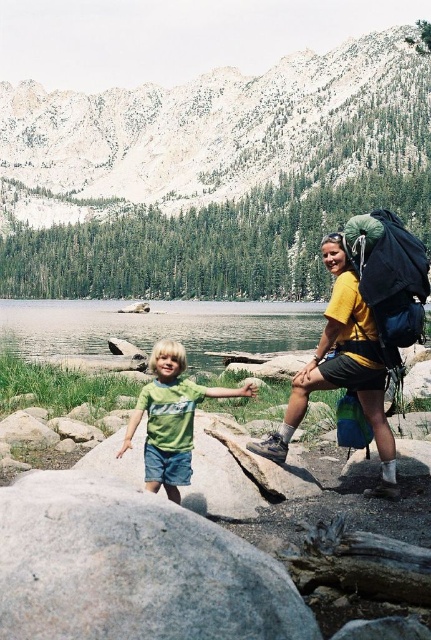
Is the position of gray rough boulder at lower left less distant than that of yellow matte backpack at right?

Yes, gray rough boulder at lower left is closer to the viewer.

Between gray rough boulder at lower left and yellow matte backpack at right, which one is positioned lower?

gray rough boulder at lower left

The width and height of the screenshot is (431, 640). In order to click on gray rough boulder at lower left in this screenshot , I will do `click(133, 568)`.

Locate an element on the screen. The image size is (431, 640). gray rough boulder at lower left is located at coordinates (133, 568).

The width and height of the screenshot is (431, 640). What do you see at coordinates (342, 368) in the screenshot? I see `yellow matte backpack at right` at bounding box center [342, 368].

Does yellow matte backpack at right have a lesser height compared to green matte shirt at center?

No, yellow matte backpack at right is not shorter than green matte shirt at center.

This screenshot has width=431, height=640. Find the location of `yellow matte backpack at right`. yellow matte backpack at right is located at coordinates (342, 368).

Based on the photo, is gray rough boulder at lower left to the right of green matte shirt at center from the viewer's perspective?

Correct, you'll find gray rough boulder at lower left to the right of green matte shirt at center.

Can you confirm if gray rough boulder at lower left is wider than green matte shirt at center?

Yes, gray rough boulder at lower left is wider than green matte shirt at center.

Which is in front, point (150, 525) or point (130, 442)?

Positioned in front is point (150, 525).

Where is `gray rough boulder at lower left`? gray rough boulder at lower left is located at coordinates 133,568.